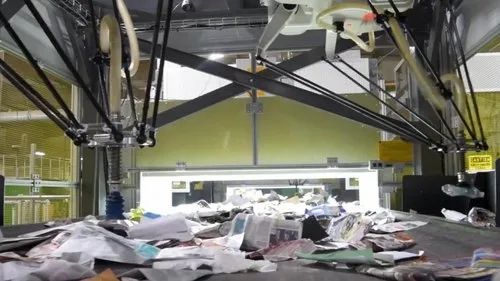
Image resolution: width=500 pixels, height=281 pixels. In order to click on hinges for glass doors in this screenshot , I will do `click(250, 107)`, `click(257, 107)`, `click(329, 162)`, `click(181, 166)`.